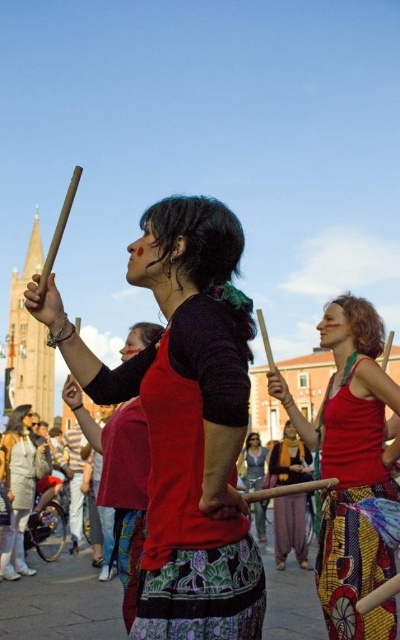
Question: Which object is the farthest from the metallic silver dress at center?

Choices:
 (A) matte yellow scarf at center
 (B) printed fabric dress at center

Answer: (B)

Question: Which object is the farthest from the matte red tank top at center?

Choices:
 (A) printed fabric dress at center
 (B) matte silver helmet at lower left
 (C) matte yellow scarf at center

Answer: (B)

Question: Which object appears closest to the camera in this image?

Choices:
 (A) matte silver helmet at lower left
 (B) matte black drumstick at center
 (C) matte red tank top at center
 (D) matte yellow scarf at center

Answer: (B)

Question: Can you confirm if printed fabric dress at center is wider than matte yellow scarf at center?

Choices:
 (A) yes
 (B) no

Answer: (A)

Question: Considering the relative positions of matte black drumstick at center and matte red tank top at center in the image provided, where is matte black drumstick at center located with respect to matte red tank top at center?

Choices:
 (A) above
 (B) below

Answer: (A)

Question: Can you confirm if printed fabric dress at center is bigger than matte silver helmet at lower left?

Choices:
 (A) no
 (B) yes

Answer: (B)